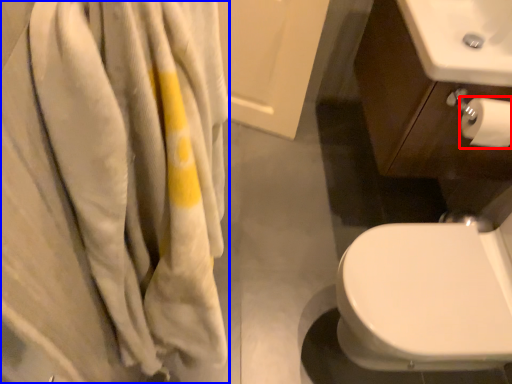
Question: Which point is closer to the camera, toilet paper (highlighted by a red box) or bath towel (highlighted by a blue box)?

Choices:
 (A) toilet paper
 (B) bath towel

Answer: (B)